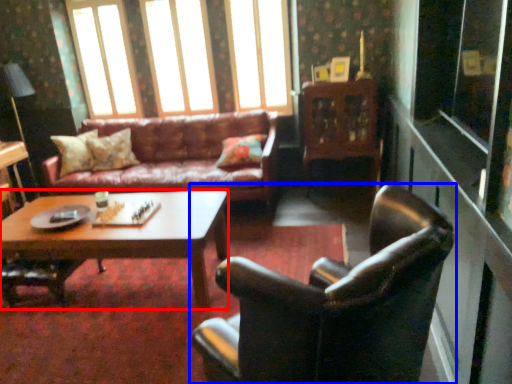
Question: Which object is further to the camera taking this photo, coffee table (highlighted by a red box) or chair (highlighted by a blue box)?

Choices:
 (A) coffee table
 (B) chair

Answer: (A)